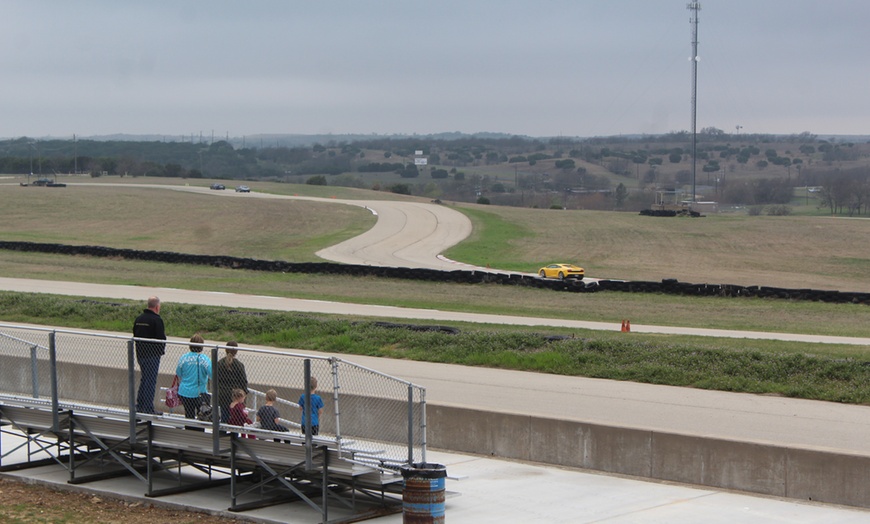
The height and width of the screenshot is (524, 870). Find the location of `1 seating area with people`. 1 seating area with people is located at coordinates (264, 440).